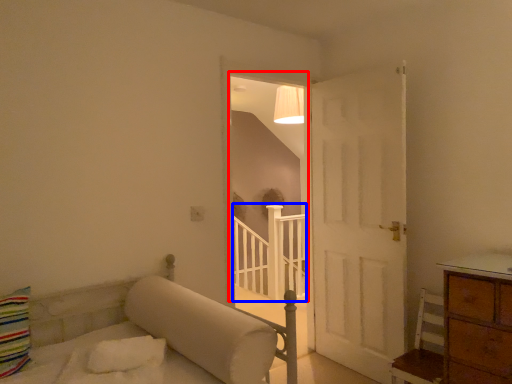
Question: Which object is closer to the camera taking this photo, window (highlighted by a red box) or balustrade (highlighted by a blue box)?

Choices:
 (A) window
 (B) balustrade

Answer: (A)